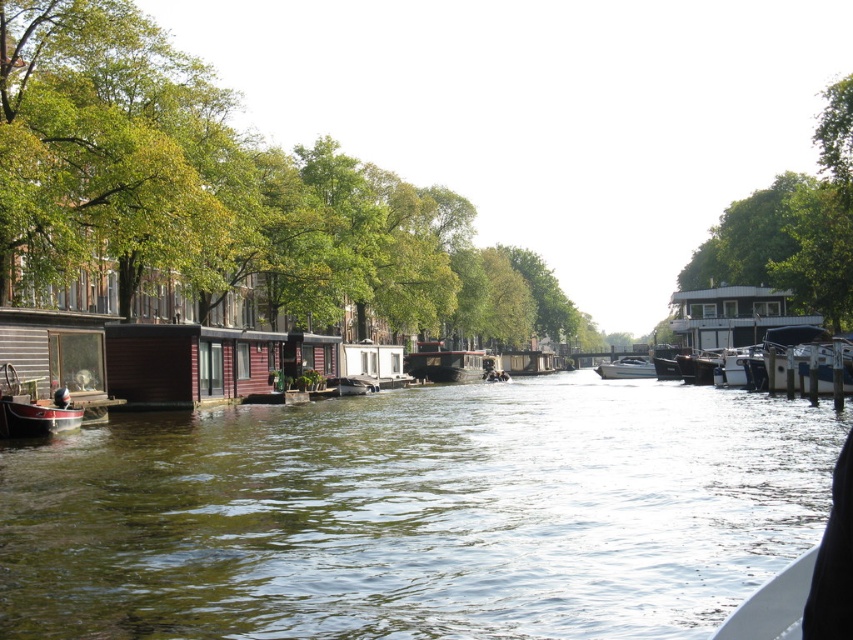
Between green leafy tree at upper left and white glossy houseboat at right, which one is positioned lower?

white glossy houseboat at right is below.

Does green leafy tree at upper left have a lesser height compared to white glossy houseboat at right?

In fact, green leafy tree at upper left may be taller than white glossy houseboat at right.

Identify the location of green leafy tree at upper left. The width and height of the screenshot is (853, 640). (223, 195).

Identify the location of green leafy tree at upper left. This screenshot has width=853, height=640. (223, 195).

Is red polished wood boat at lower left shorter than wooden cabin cruiser at center?

Correct, red polished wood boat at lower left is not as tall as wooden cabin cruiser at center.

Is point (51, 406) closer to camera compared to point (434, 369)?

Yes, it is.

Does point (38, 429) lie behind point (463, 380)?

No, (38, 429) is closer to viewer.

At what (x,y) coordinates should I click in order to perform the action: click on red polished wood boat at lower left. Please return your answer as a coordinate pair (x, y). Looking at the image, I should click on (33, 417).

Between green water at center and wooden cabin cruiser at center, which one appears on the right side from the viewer's perspective?

green water at center is more to the right.

Which is more to the left, green water at center or wooden cabin cruiser at center?

wooden cabin cruiser at center is more to the left.

This screenshot has height=640, width=853. In order to click on green water at center in this screenshot , I will do `click(416, 513)`.

Identify the location of green water at center. (416, 513).